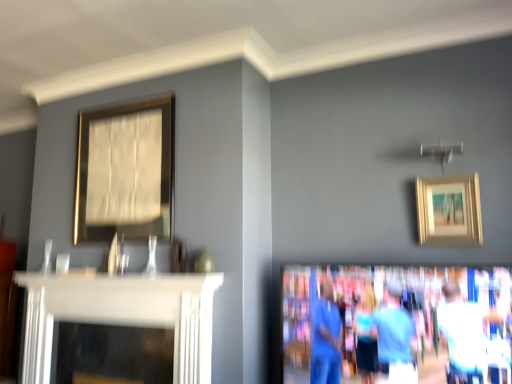
Image resolution: width=512 pixels, height=384 pixels. I want to click on vacant space situated above gold/golden frame at upper right, positioned as the 2th picture frame in back-to-front order (from a real-world perspective), so click(x=444, y=177).